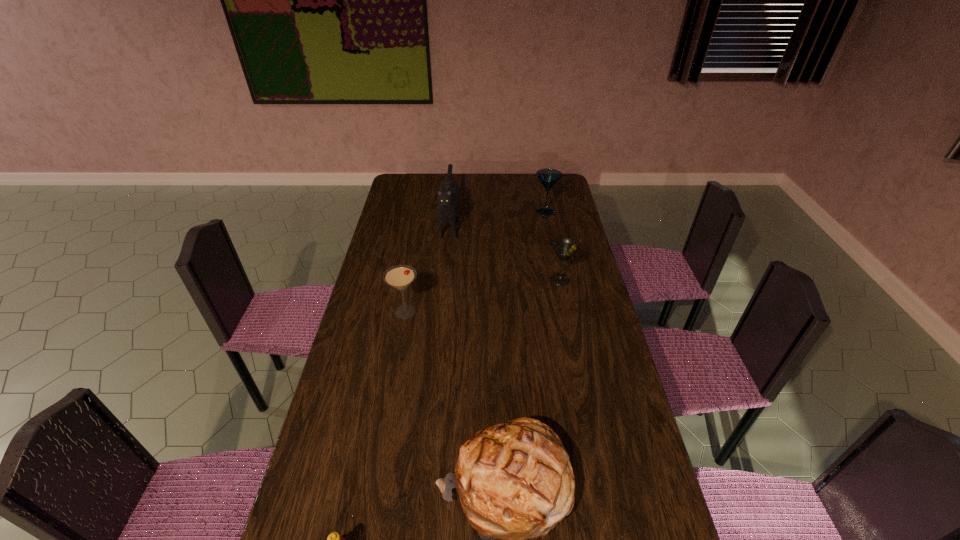
At what (x,y) coordinates should I click in order to perform the action: click on object present at the left edge. Please return your answer as a coordinate pair (x, y). Looking at the image, I should click on (399, 277).

The height and width of the screenshot is (540, 960). I want to click on vacant region at the far edge of the desktop, so click(x=500, y=180).

I want to click on vacant area at the left edge, so click(x=372, y=394).

Find the location of `vacant point at the right edge`. vacant point at the right edge is located at coordinates (567, 349).

Identify the location of free space between the farthest martini and the leftmost martini. (475, 262).

Locate an element on the screen. unoccupied area between the third farthest object and the leftmost martini is located at coordinates (x=483, y=296).

The image size is (960, 540). In order to click on free space between the leftmost martini and the farthest martini in this screenshot , I will do `click(475, 262)`.

Identify the location of vacant point located between the nearest martini and the fourth nearest object. The image size is (960, 540). [x=483, y=296].

I want to click on free space between the nearest martini and the farthest martini, so click(x=475, y=262).

Where is `object that stands as the fifth closest to the farthest martini`? Image resolution: width=960 pixels, height=540 pixels. object that stands as the fifth closest to the farthest martini is located at coordinates (334, 539).